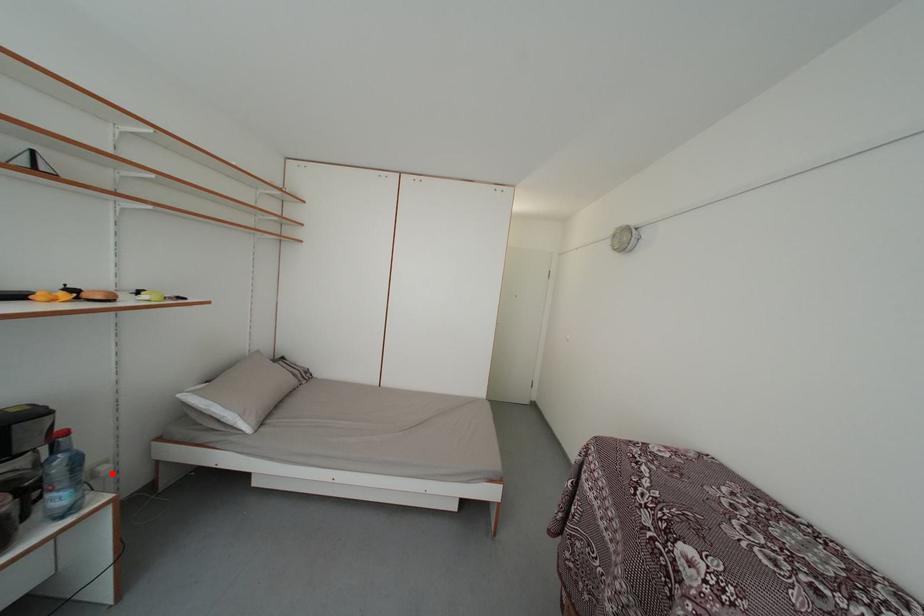
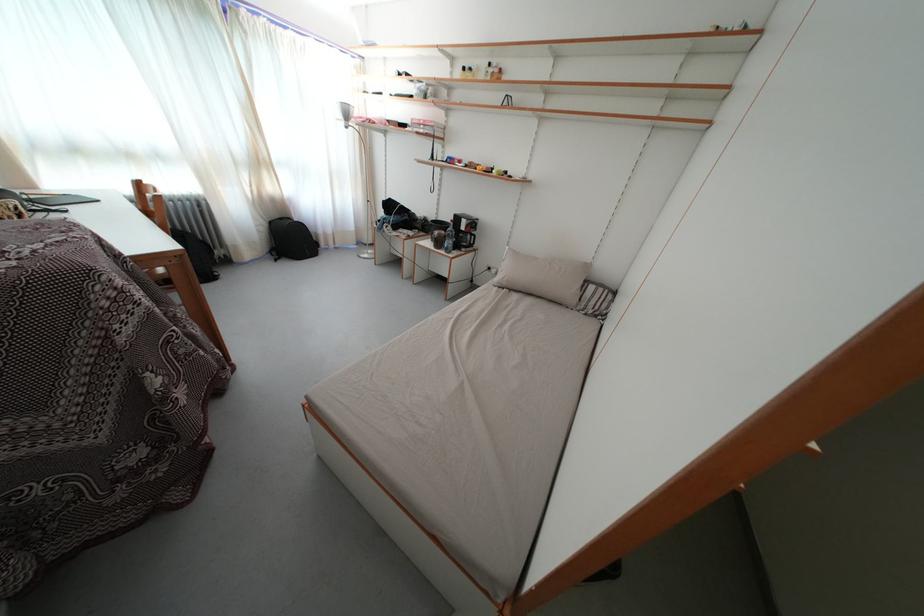
Question: I am providing you with two images of the same scene from different viewpoints. Given a red point in image1, look at the same physical point in image2. Is it:

Choices:
 (A) Closer to the viewpoint
 (B) Farther from the viewpoint

Answer: (A)